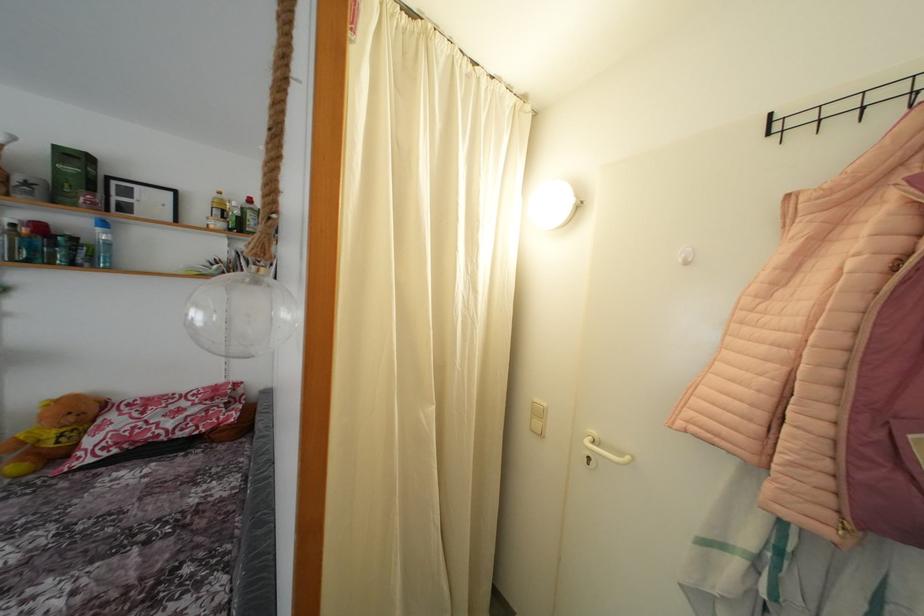
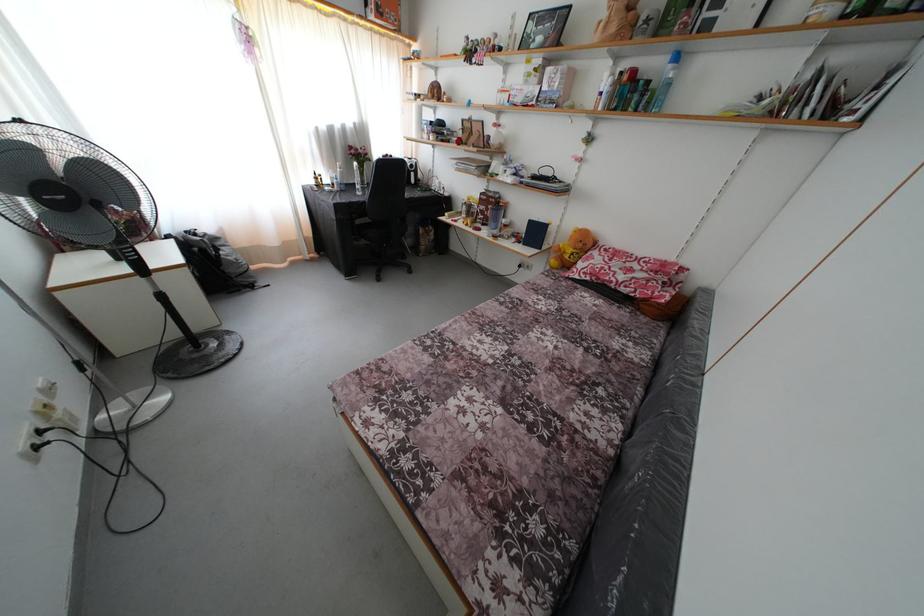
The images are taken continuously from a first-person perspective. In which direction is your viewpoint rotating?

The camera's rotation is toward left-down.